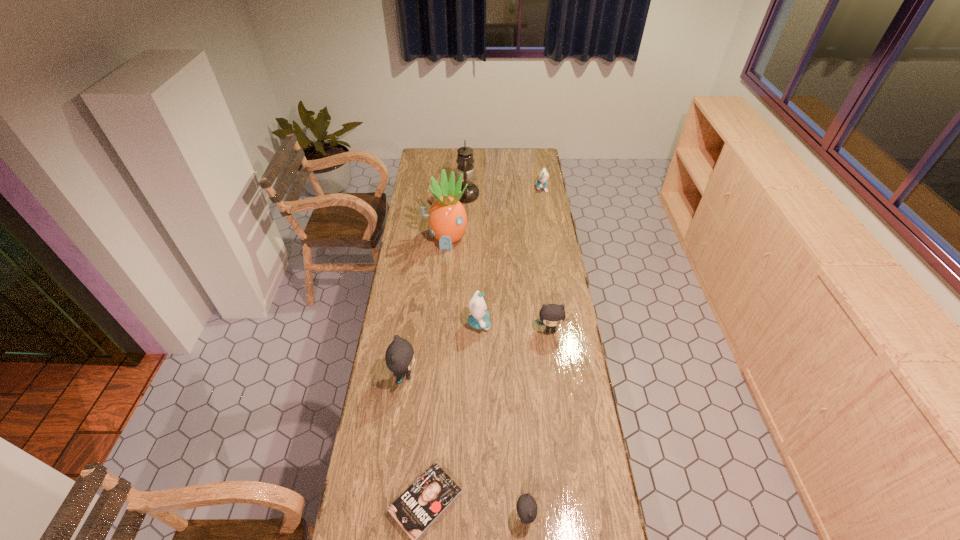
Locate an element on the screen. The width and height of the screenshot is (960, 540). object that stands as the fourth closest to the book is located at coordinates (551, 315).

Image resolution: width=960 pixels, height=540 pixels. What are the coordinates of `object that is the fourth closest to the leftmost kitten` in the screenshot? It's located at (526, 508).

At what (x,y) coordinates should I click in order to perform the action: click on kitten that stands as the closest to the nearer blue kitten. Please return your answer as a coordinate pair (x, y). The height and width of the screenshot is (540, 960). Looking at the image, I should click on (551, 315).

Where is `kitten that stands as the second closest to the shortest object`? kitten that stands as the second closest to the shortest object is located at coordinates (399, 357).

At what (x,y) coordinates should I click in order to perform the action: click on gray kitten that is the second closest one to the oil lamp. Please return your answer as a coordinate pair (x, y). Image resolution: width=960 pixels, height=540 pixels. Looking at the image, I should click on (399, 357).

You are a GUI agent. You are given a task and a screenshot of the screen. Output one action in this format:
    pyautogui.click(x=<x>, y=<y>)
    Task: Click on the gray kitten that stands as the second closest to the nearest kitten
    Image resolution: width=960 pixels, height=540 pixels.
    Given the screenshot: What is the action you would take?
    pyautogui.click(x=551, y=315)